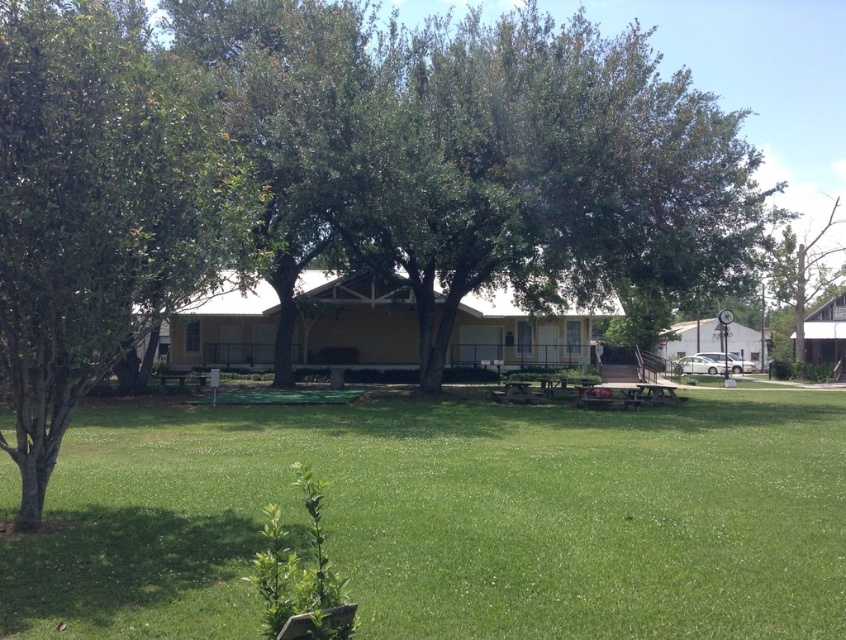
You are planning to set up a picnic blanket in the green grass at center. However, there is a green leafy tree at left nearby. Based on their positions, will the tree cast a shadow over the picnic area during the afternoon when the sun is in the west?

The green grass at center is to the right of the green leafy tree at left. Since the sun is in the west during the afternoon, the tree will cast a shadow to the east, which would cover the picnic area on the right side. Therefore, the green leafy tree at left will cast a shadow over the picnic area in the green grass at center during the afternoon.

You are standing at the point labeled as point (x=449, y=518) in the image. What is the object you are currently standing on?

The point (x=449, y=518) indicates green grass at center, so you are standing on green grass at center.